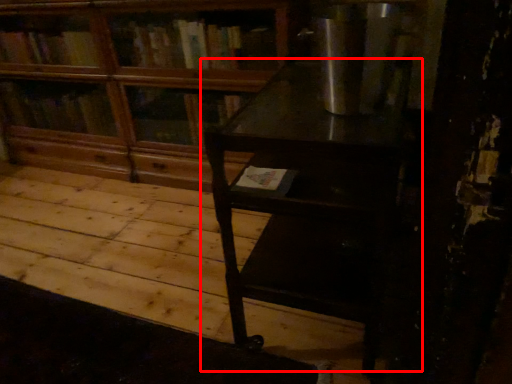
Question: From the image's perspective, considering the relative positions of table (annotated by the red box) and bookcase in the image provided, where is table (annotated by the red box) located with respect to the staircase?

Choices:
 (A) below
 (B) above

Answer: (A)